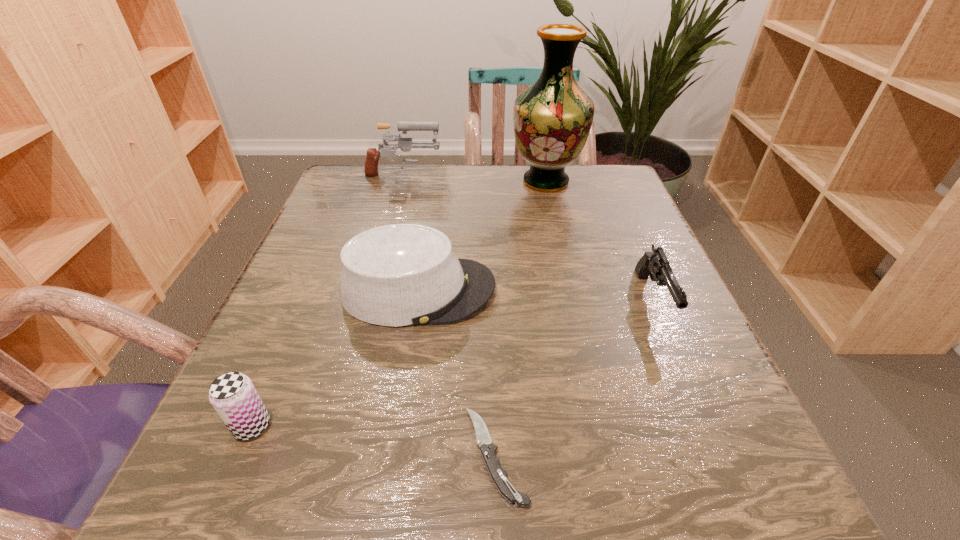
Point out which object is positioned as the nearest to the shortest object. Please provide its 2D coordinates. Your answer should be formatted as a tuple, i.e. [(x, y)], where the tuple contains the x and y coordinates of a point satisfying the conditions above.

[(396, 275)]

Locate an element on the screen. The width and height of the screenshot is (960, 540). object that stands as the second closest to the hat is located at coordinates (233, 395).

Identify the location of free spot that satisfies the following two spatial constraints: 1. on the front-facing side of the hat; 2. on the left side of the pocketknife. This screenshot has width=960, height=540. (393, 455).

Where is `free space that satisfies the following two spatial constraints: 1. on the front-facing side of the shortest object; 2. on the right side of the hat`? free space that satisfies the following two spatial constraints: 1. on the front-facing side of the shortest object; 2. on the right side of the hat is located at coordinates (393, 455).

Locate an element on the screen. free spot that satisfies the following two spatial constraints: 1. on the front-facing side of the hat; 2. on the left side of the pocketknife is located at coordinates (393, 455).

At what (x,y) coordinates should I click in order to perform the action: click on vacant space that satisfies the following two spatial constraints: 1. on the front side of the shortest object; 2. on the right side of the beer can. Please return your answer as a coordinate pair (x, y). The width and height of the screenshot is (960, 540). Looking at the image, I should click on (239, 455).

This screenshot has height=540, width=960. In order to click on vacant space that satisfies the following two spatial constraints: 1. on the back side of the second object from right to left; 2. at the barrel end of the farther gun in this screenshot , I will do `click(545, 178)`.

Identify the location of free space in the image that satisfies the following two spatial constraints: 1. on the front-facing side of the shortest object; 2. on the right side of the hat. (393, 455).